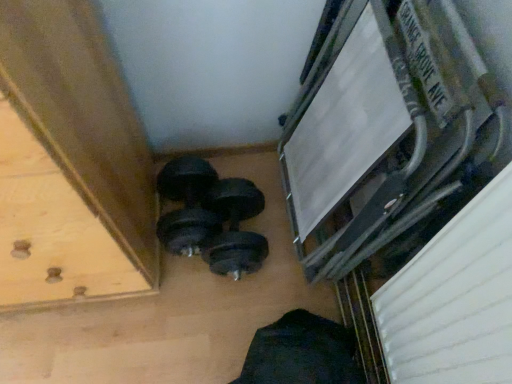
Locate an element on the screen. vacant space in front of black rubber dumbbell at center, the 1th dumbbell viewed from the right is located at coordinates (213, 310).